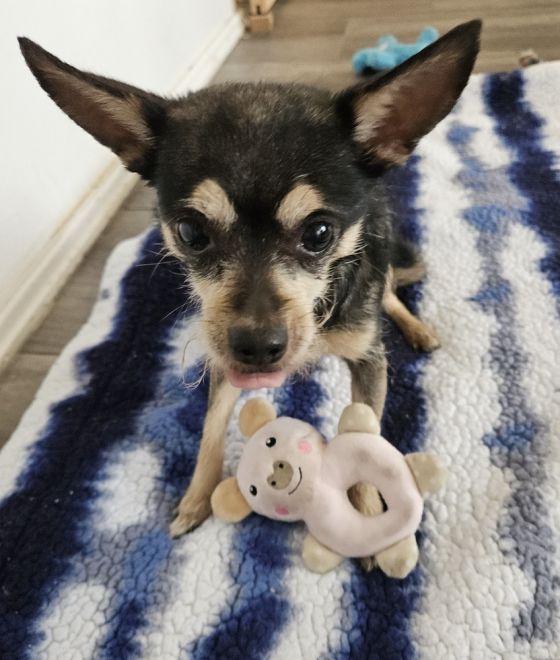
At what (x,y) coordinates should I click in order to perform the action: click on blue stuffed animal. Please return your answer as a coordinate pair (x, y). The height and width of the screenshot is (660, 560). Looking at the image, I should click on (388, 47).